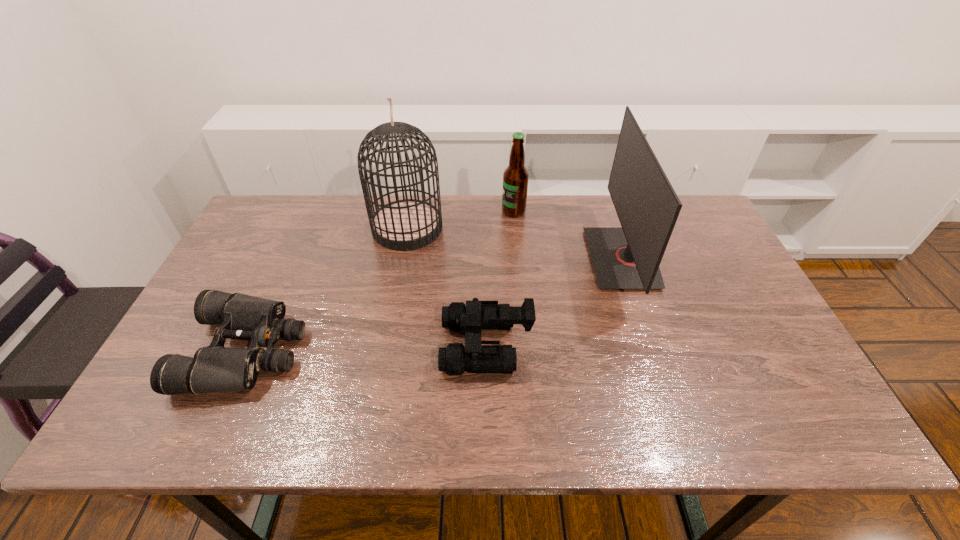
Where is `blank area in the image that satisfies the following two spatial constraints: 1. on the front side of the fourth object from right to left; 2. through the eyepieces of the leftmost object`? This screenshot has height=540, width=960. blank area in the image that satisfies the following two spatial constraints: 1. on the front side of the fourth object from right to left; 2. through the eyepieces of the leftmost object is located at coordinates (385, 350).